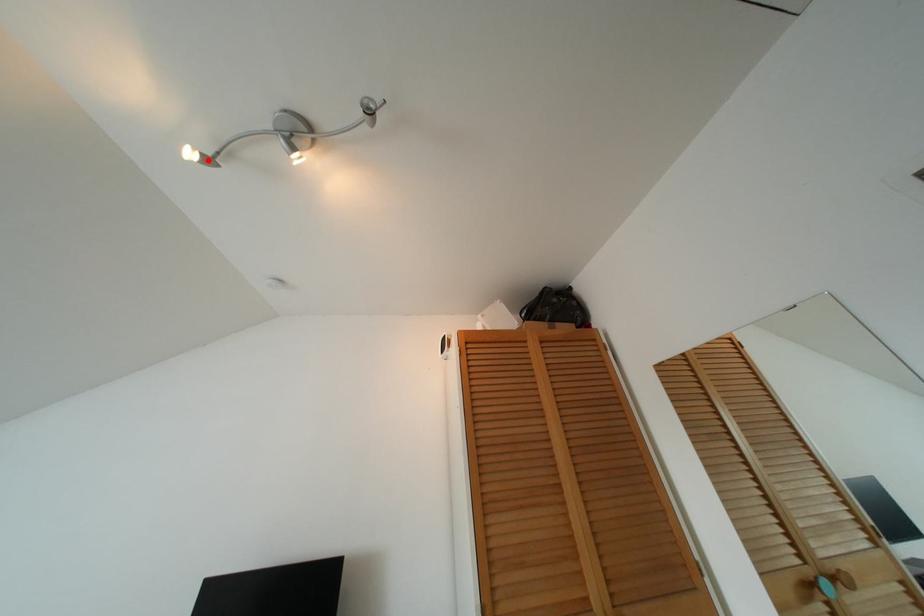
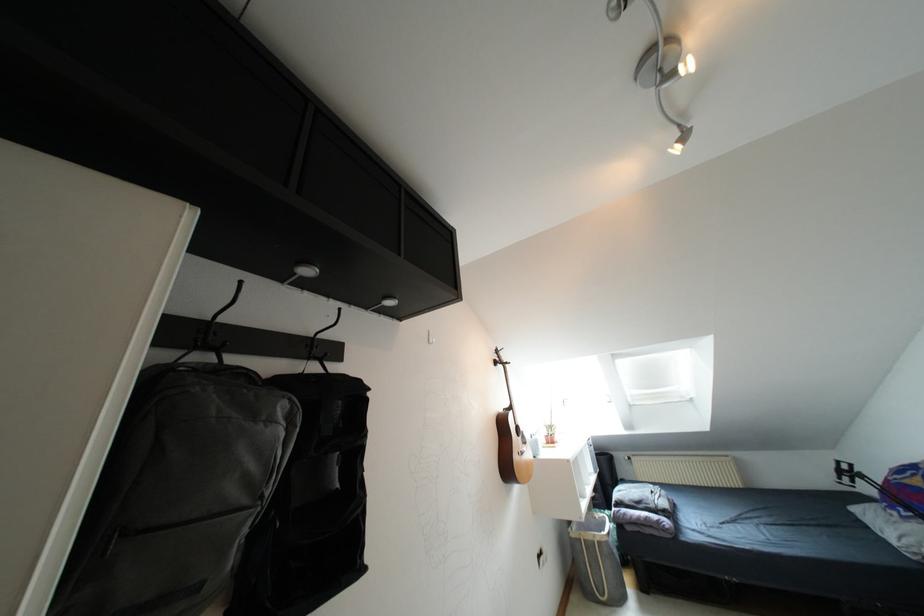
The point at the highlighted location is marked in the first image. Where is the corresponding point in the second image?

(683, 138)